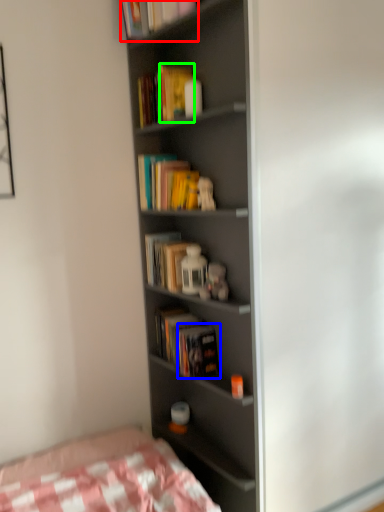
Question: Which object is the closest to the book (highlighted by a red box)? Choose among these: paperback book (highlighted by a blue box) or paperback book (highlighted by a green box).

Choices:
 (A) paperback book
 (B) paperback book

Answer: (B)